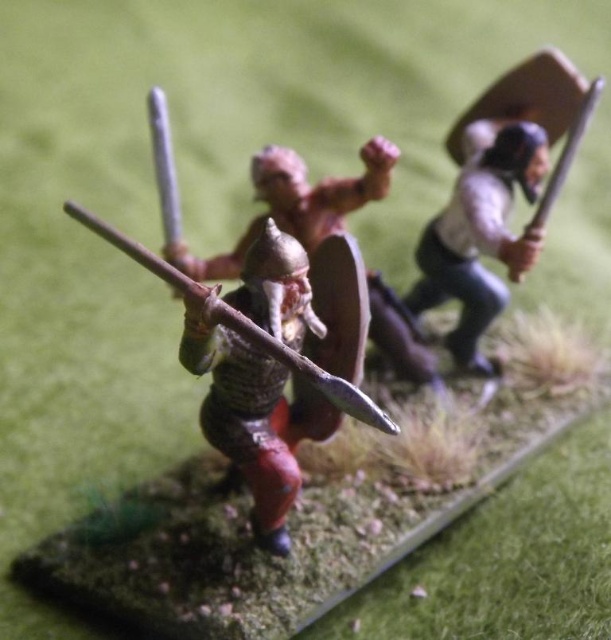
You are a medieval knight in the diorama and need to determine which object is shorter. Looking at the metallic spear at center and the wooden shield at upper right, which one is shorter?

The metallic spear at center is not as tall as the wooden shield at upper right, so the metallic spear at center is shorter.

You are a medieval knight planning to attack the wooden shield at upper right. Based on the scene, can you reach the shield with your spear from your current position at the metallic armor at center?

The metallic armor at center is taller than the wooden shield at upper right, so yes, the knight can reach the shield with their spear from their current position since the spear is thrust forward and the armor is positioned higher.

You are a medieval knight in the diorama and need to decide which item to prioritize for your armor. The metallic spear at center and the wooden shield at upper right are both available. Based on their sizes, which one should you choose to carry comfortably?

The metallic spear at center is larger in size than the wooden shield at upper right, so it would be more challenging to carry comfortably. The knight should choose the wooden shield at upper right for better manageability.